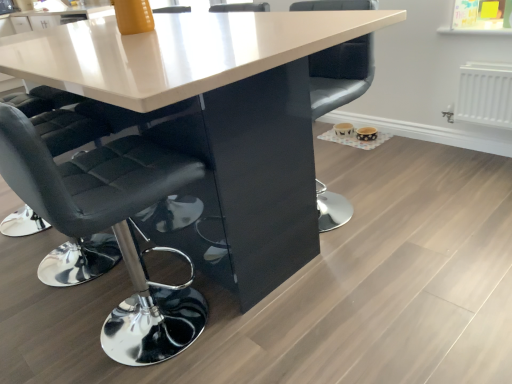
This screenshot has height=384, width=512. Identify the location of free region on the left part of black leather chair at left, which appears as the 1th chair when viewed from the left. (48, 329).